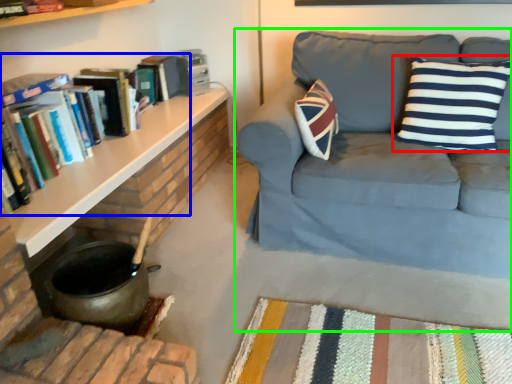
Question: Based on their relative distances, which object is farther from pillow (highlighted by a red box)? Choose from book (highlighted by a blue box) and studio couch (highlighted by a green box).

Choices:
 (A) book
 (B) studio couch

Answer: (A)